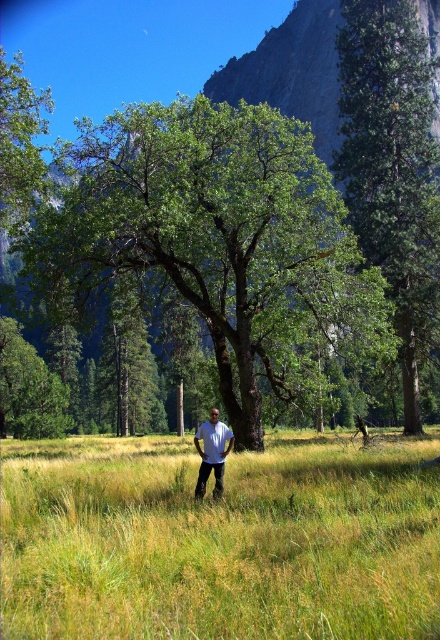
You are a photographer trying to capture the person in the scene. The green grass at center and white cotton shirt at center are both in your viewfinder. Which object is positioned lower in the image?

The green grass at center is located below white cotton shirt at center, so the green grass at center is positioned lower in the image.

You are planning to take a photo of the green rough bark tree at center and the white cotton shirt at center. Which object will appear taller in the photo?

The green rough bark tree at center will appear taller in the photo because it has a greater height compared to the white cotton shirt at center.